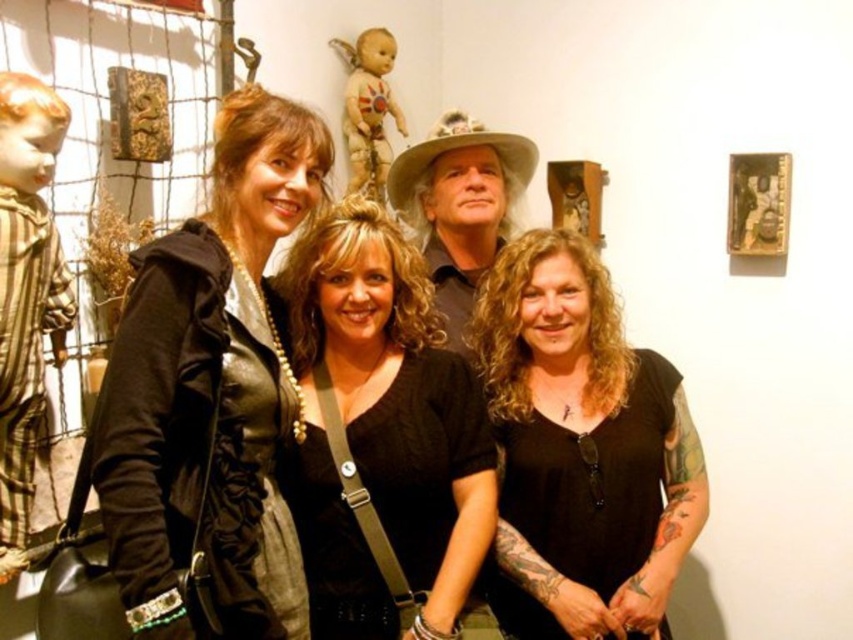
Looking at this image, is striped fabric doll at left thinner than matte black shirt at center?

Indeed, striped fabric doll at left has a lesser width compared to matte black shirt at center.

Between striped fabric doll at left and matte black shirt at center, which one has more height?

striped fabric doll at left

Which is behind, point (26, 515) or point (419, 150)?

The point (419, 150) is behind.

The image size is (853, 640). I want to click on striped fabric doll at left, so (x=26, y=292).

Between leather jacket at center and black leather top at center, which one has more height?

Standing taller between the two is leather jacket at center.

Does point (221, 257) come farther from viewer compared to point (329, 432)?

No.

Does point (146, 424) come in front of point (397, 572)?

Yes.

I want to click on leather jacket at center, so click(x=212, y=390).

Based on the photo, does striped fabric doll at left appear over matte painted wood doll at upper center?

No.

Is striped fabric doll at left to the left of matte painted wood doll at upper center from the viewer's perspective?

Yes, striped fabric doll at left is to the left of matte painted wood doll at upper center.

In order to click on striped fabric doll at left in this screenshot , I will do `click(26, 292)`.